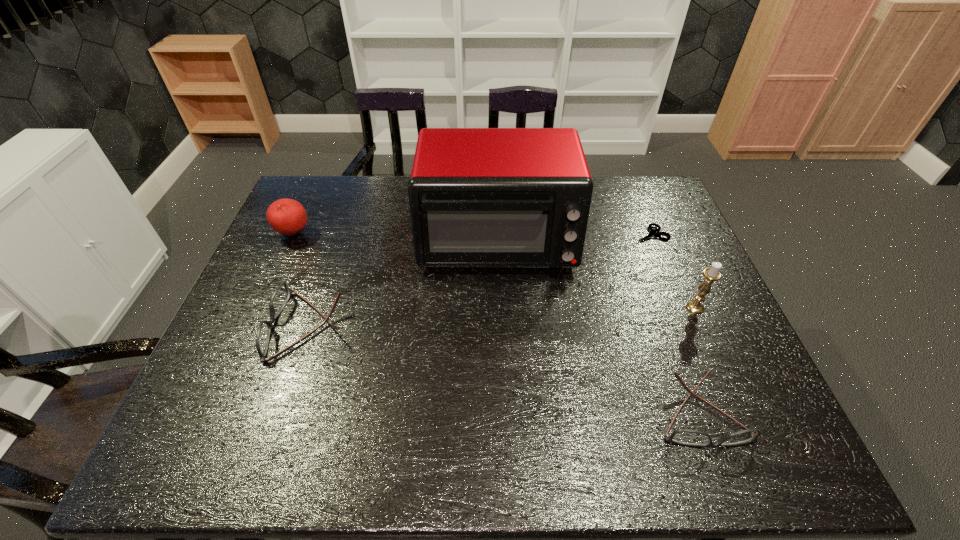
Identify the location of free space located on the front-facing side of the farther spectacles. (239, 326).

You are a GUI agent. You are given a task and a screenshot of the screen. Output one action in this format:
    pyautogui.click(x=<x>, y=<y>)
    Task: Click on the free location located on the back of the shortest object
    The image size is (960, 540).
    Given the screenshot: What is the action you would take?
    pyautogui.click(x=634, y=194)

Find the location of a particular element. The height and width of the screenshot is (540, 960). vacant area situated on the front-facing side of the tallest object is located at coordinates (499, 300).

The width and height of the screenshot is (960, 540). I want to click on free space located 0.080m on the back of the fourth shortest object, so pos(305,207).

Where is `free space located on the back of the fifth shortest object`? This screenshot has height=540, width=960. free space located on the back of the fifth shortest object is located at coordinates (672, 255).

The width and height of the screenshot is (960, 540). Find the location of `object located in the far edge section of the desktop`. object located in the far edge section of the desktop is located at coordinates (479, 197).

What are the coordinates of `object situated at the near edge` in the screenshot? It's located at (688, 437).

Find the location of `spectacles that is at the left edge`. spectacles that is at the left edge is located at coordinates (281, 295).

Image resolution: width=960 pixels, height=540 pixels. I want to click on apple present at the left edge, so click(x=288, y=217).

This screenshot has width=960, height=540. Find the location of `spectacles at the right edge`. spectacles at the right edge is located at coordinates (688, 437).